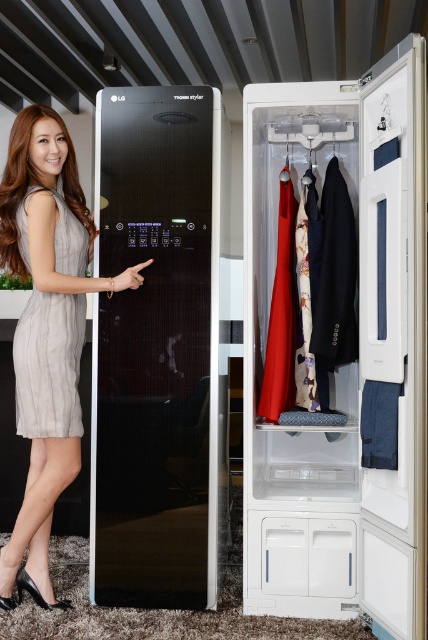
Question: Can you confirm if silky red dress at center is positioned above red fabric hanger at center?

Choices:
 (A) yes
 (B) no

Answer: (B)

Question: Is silky red dress at center thinner than red fabric hanger at center?

Choices:
 (A) yes
 (B) no

Answer: (B)

Question: Which object is positioned closest to the silky red dress at center?

Choices:
 (A) light gray sheer dress at left
 (B) black glass lg styler at left
 (C) white plastic closet at center

Answer: (C)

Question: Can you confirm if white plastic closet at center is bigger than silky red dress at center?

Choices:
 (A) no
 (B) yes

Answer: (B)

Question: Which of the following is the closest to the observer?

Choices:
 (A) (413, 381)
 (B) (50, 358)
 (C) (345, 243)
 (D) (285, 177)

Answer: (A)

Question: Estimate the real-world distances between objects in this image. Which object is closer to the red fabric hanger at center?

Choices:
 (A) light gray sheer dress at left
 (B) black glass lg styler at left
 (C) black fabric coat at center

Answer: (C)